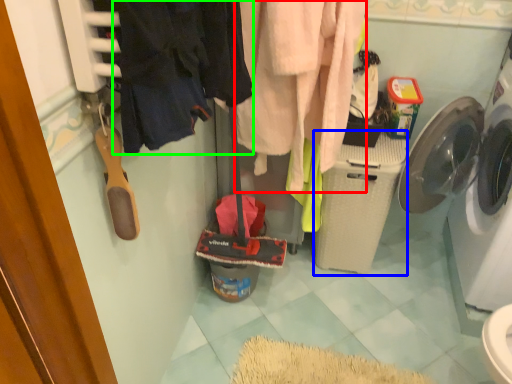
Question: Based on their relative distances, which object is nearer to clothing (highlighted by a red box)? Choose from washing machine (highlighted by a blue box) and clothing (highlighted by a green box).

Choices:
 (A) washing machine
 (B) clothing

Answer: (A)